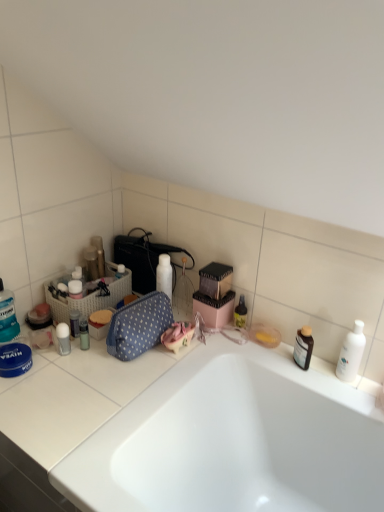
This screenshot has width=384, height=512. Find the location of `free region on the left part of white glossy bottle at right, which is the 10th toiletry in left-to-right order`. free region on the left part of white glossy bottle at right, which is the 10th toiletry in left-to-right order is located at coordinates (302, 373).